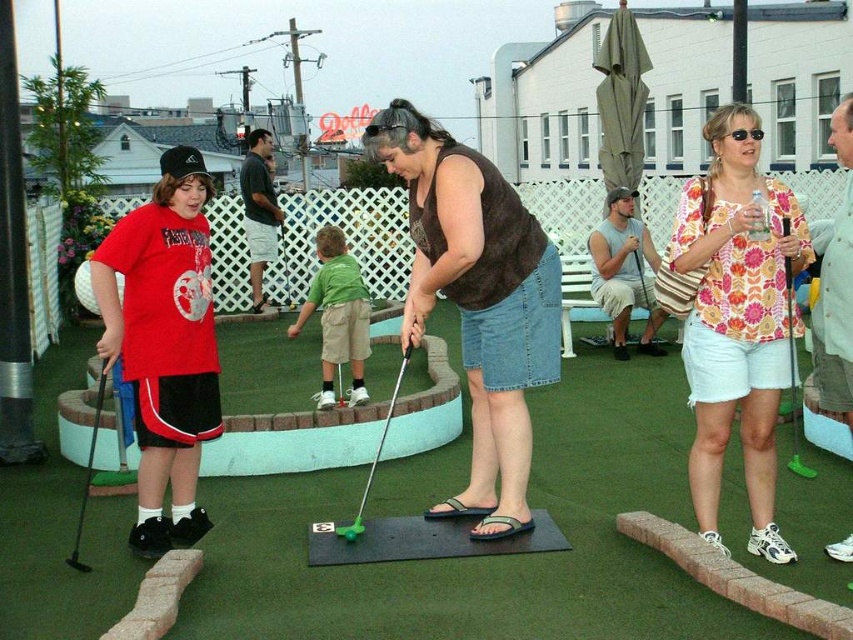
Is point (508, 557) closer to viewer compared to point (825, 307)?

No, (508, 557) is behind (825, 307).

Who is more distant from viewer, (51, 595) or (830, 259)?

The point (51, 595) is more distant.

Locate an element on the screen. green artificial turf at center is located at coordinates (485, 557).

Between gray sleeveless shirt at center and green plastic golf club at lower left, which one is positioned higher?

gray sleeveless shirt at center is above.

What do you see at coordinates (624, 272) in the screenshot? This screenshot has width=853, height=640. I see `gray sleeveless shirt at center` at bounding box center [624, 272].

Does point (633, 259) lie behind point (97, 385)?

Yes.

Find the location of a particular element. gray sleeveless shirt at center is located at coordinates (624, 272).

Between gray sleeveless shirt at center and matte khaki shorts at center, which one has more height?

gray sleeveless shirt at center is taller.

Between point (625, 349) and point (253, 150), which one is positioned in front?

Point (625, 349)

Measure the distance between gray sleeveless shirt at center and camera.

The distance of gray sleeveless shirt at center from camera is 8.16 meters.

Where is `gray sleeveless shirt at center`? This screenshot has height=640, width=853. gray sleeveless shirt at center is located at coordinates (624, 272).